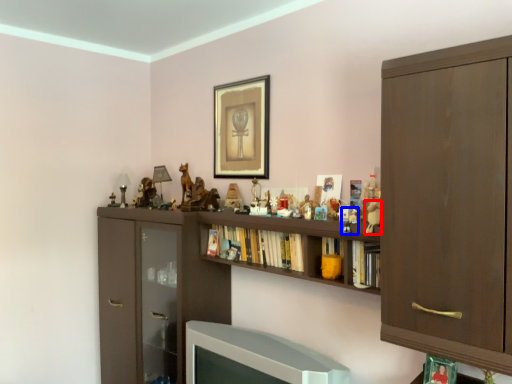
Question: Which object appears closest to the camera in this image, toy (highlighted by a red box) or toy (highlighted by a blue box)?

Choices:
 (A) toy
 (B) toy

Answer: (A)